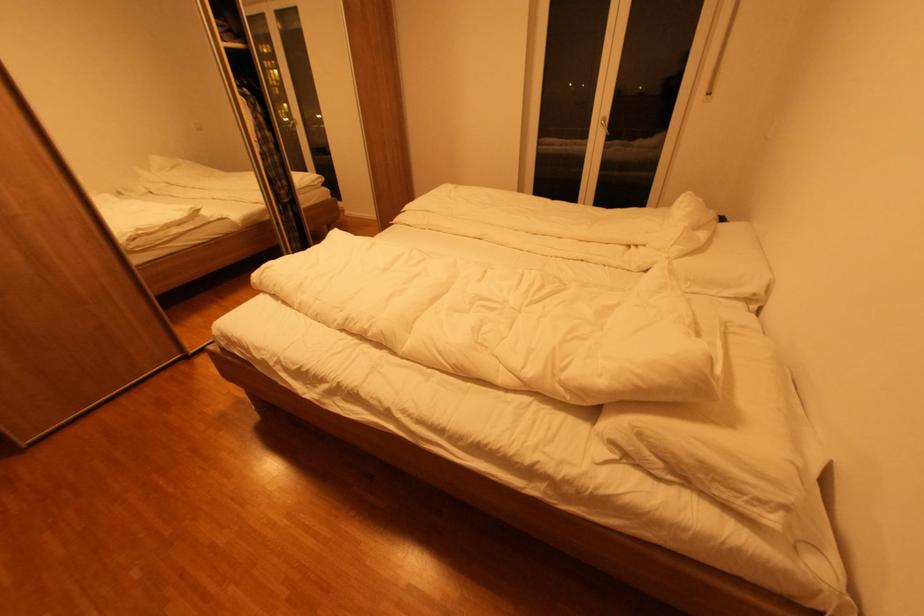
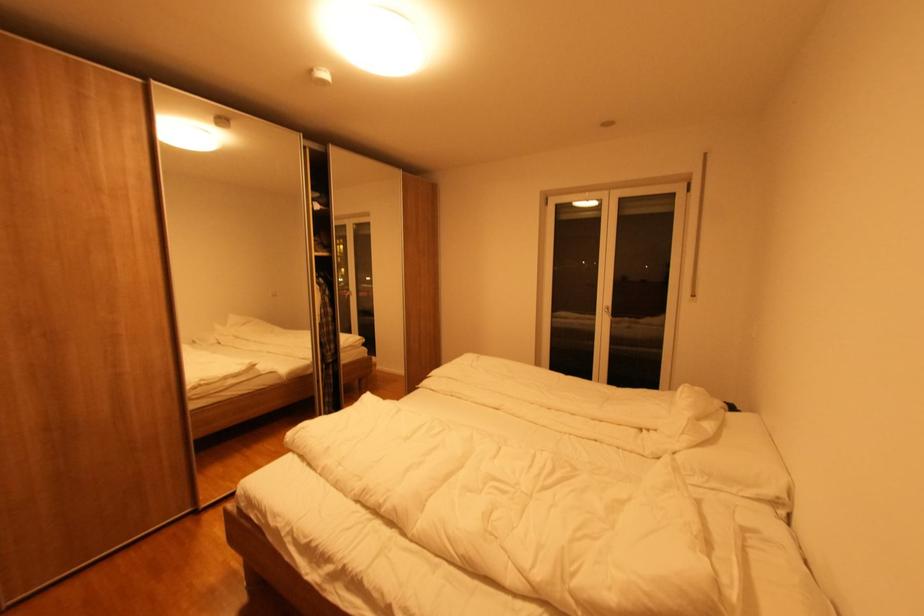
Question: Based on the continuous images, in which direction is the camera rotating? Reply with the corresponding letter.

Choices:
 (A) Left
 (B) Right
 (C) Up
 (D) Down

Answer: (C)